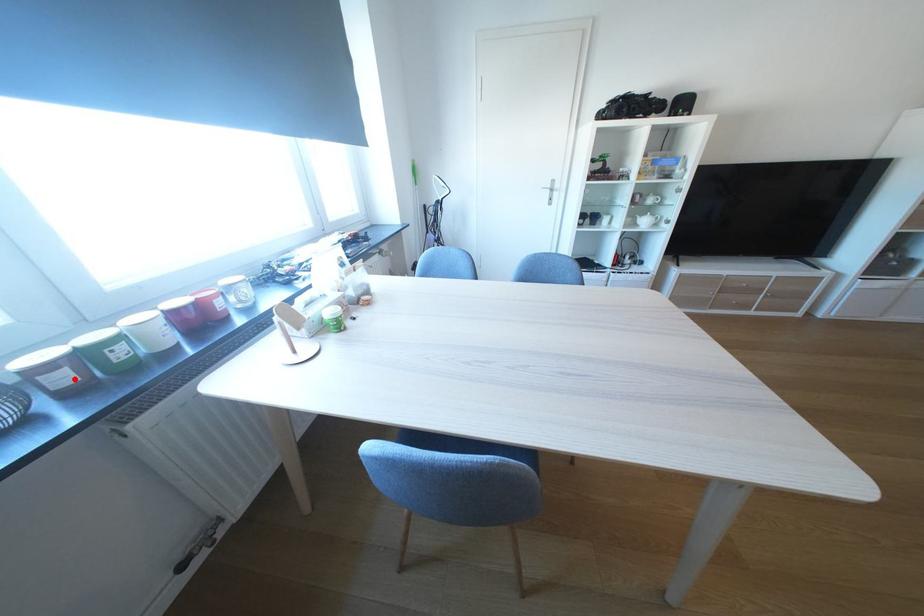
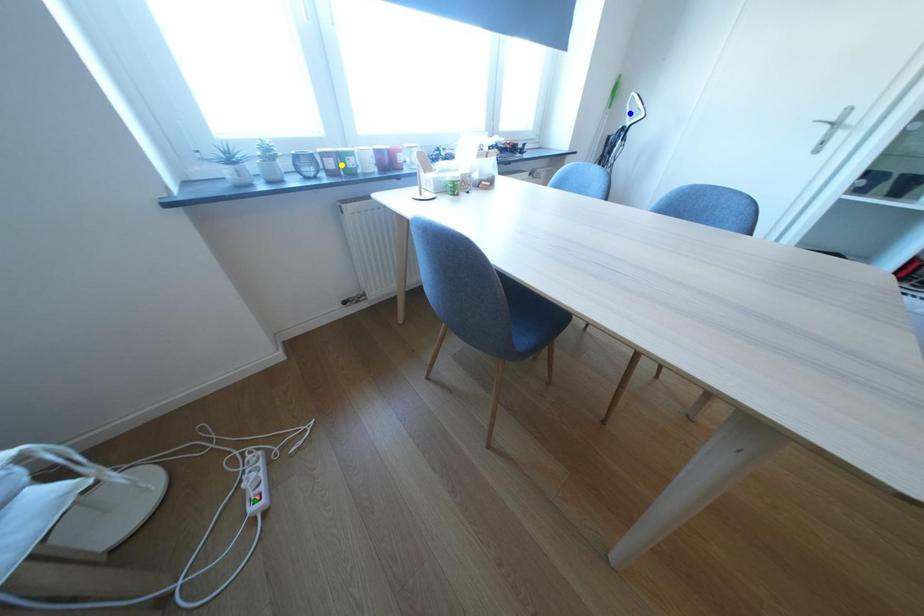
Question: I am providing you with two images of the same scene from different viewpoints. A red point is marked on the first image. You are given multiple points on the second image. Which spot in image 2 lines up with the point in image 1?

Choices:
 (A) blue point
 (B) green point
 (C) yellow point

Answer: (C)